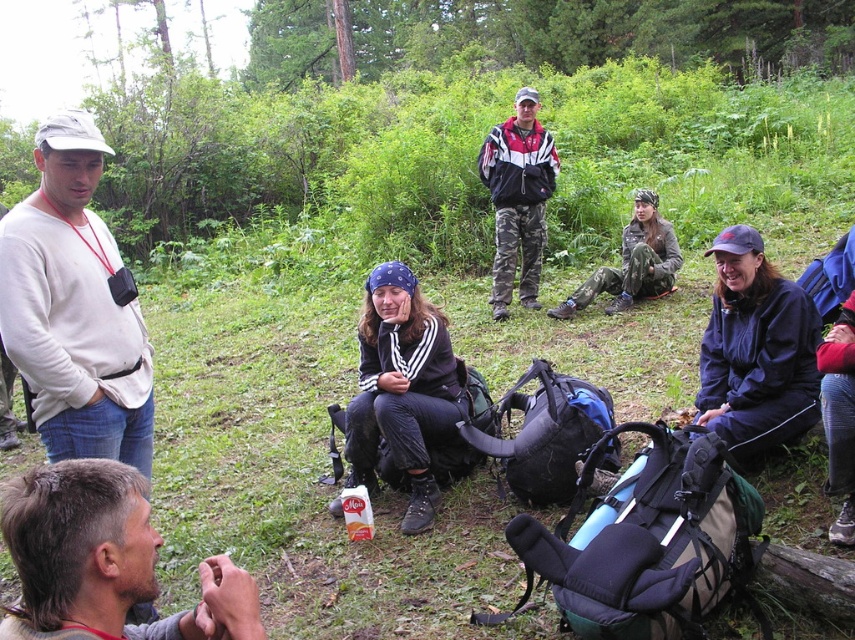
Between brown hair at lower left and camouflage pants at center, which one has less height?

brown hair at lower left

Which is behind, point (39, 500) or point (537, 253)?

The point (537, 253) is more distant.

At what (x,y) coordinates should I click in order to perform the action: click on brown hair at lower left. Please return your answer as a coordinate pair (x, y). The width and height of the screenshot is (855, 640). Looking at the image, I should click on click(104, 561).

Does white matte shirt at left have a greater width compared to brown hair at lower left?

Yes.

Measure the distance between point (78, 164) and camera.

Point (78, 164) is 2.61 meters away from camera.

Does point (74, 337) come in front of point (97, 630)?

No, it is behind (97, 630).

Identify the location of white matte shirt at left. (74, 307).

Is white matte shirt at left to the right of camouflage pants at center from the viewer's perspective?

Incorrect, white matte shirt at left is not on the right side of camouflage pants at center.

Who is positioned more to the right, white matte shirt at left or camouflage pants at center?

camouflage pants at center is more to the right.

Does point (55, 378) come behind point (511, 154)?

No, (55, 378) is closer to viewer.

The width and height of the screenshot is (855, 640). I want to click on white matte shirt at left, so click(74, 307).